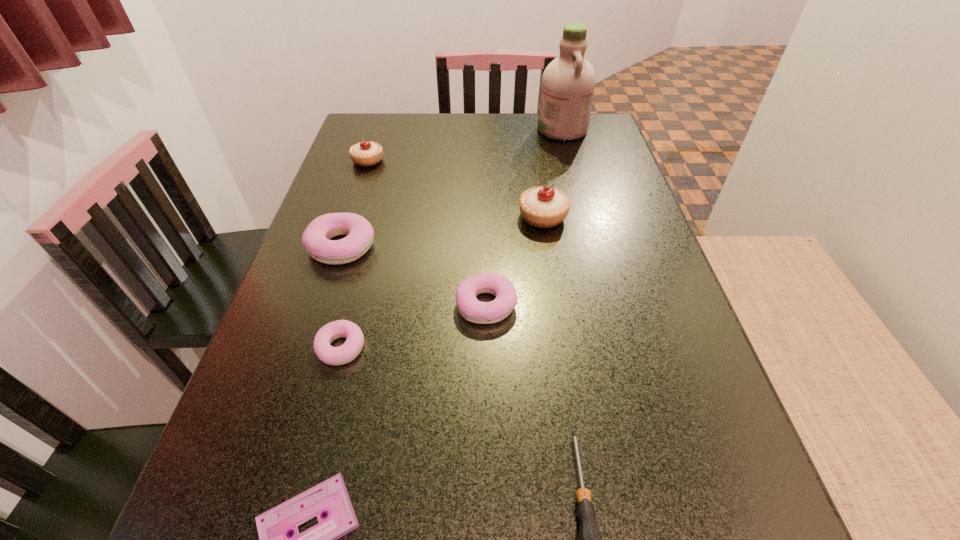
Locate an element on the screen. pink pastry that is the closest to the smallest pink pastry is located at coordinates (316, 238).

Find the location of a particular element. blank space that satisfies the following two spatial constraints: 1. on the front label of the tallest object; 2. on the front side of the tallest pastry is located at coordinates (586, 217).